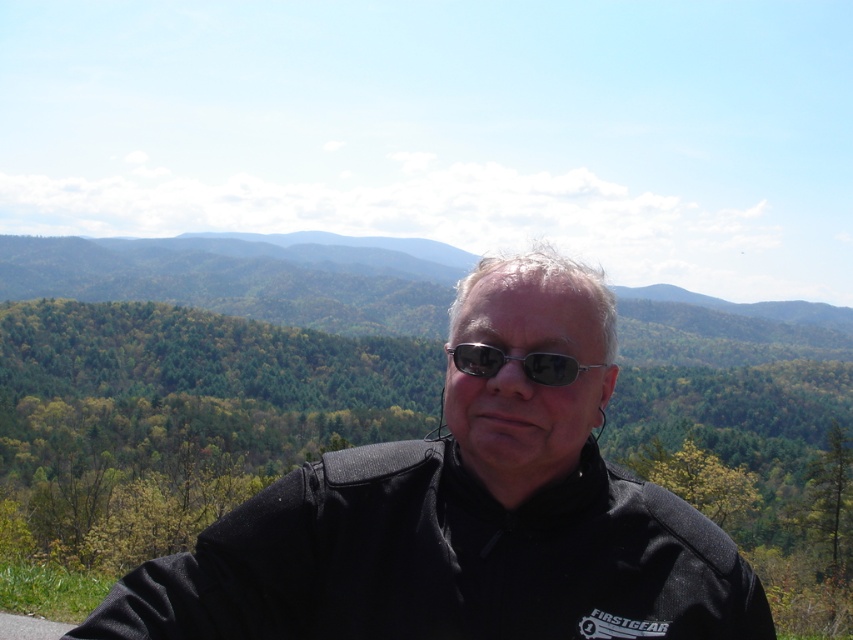
You are a fashion designer analyzing the outfit of a person in a scenic outdoor setting. You need to determine the spatial arrangement of the black matte jacket at center and the metallic frame sunglasses at center. Which item is positioned lower on the person?

The black matte jacket at center is located below metallic frame sunglasses at center, so the jacket is positioned lower than the sunglasses.

You are a fashion designer analyzing the positioning of the black matte jacket at center in the image. What are the coordinates of the jacket?

The black matte jacket at center is located at point (463, 513).